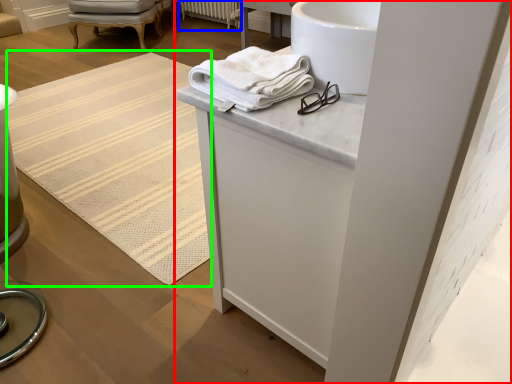
Question: Considering the real-world distances, which object is closest to bathroom cabinet (highlighted by a red box)? radiator (highlighted by a blue box) or mat (highlighted by a green box).

Choices:
 (A) radiator
 (B) mat

Answer: (B)